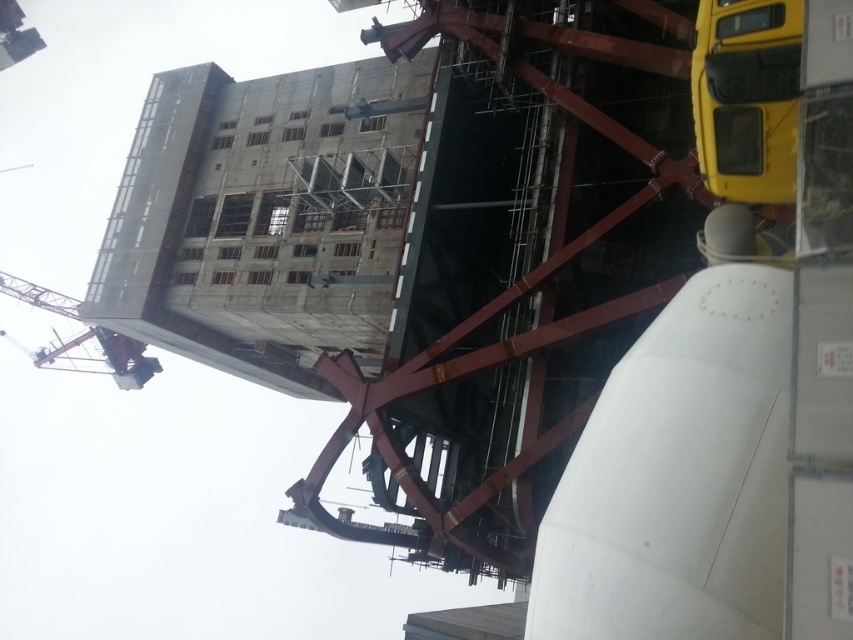
You are an inspector on the construction site and need to assess the placement of the yellow matte truck at upper right and the metallic red crane at upper left. From your vantage point, which object is higher in elevation?

The yellow matte truck at upper right is positioned over metallic red crane at upper left, meaning it is higher in elevation than the crane.

You are a construction worker who needs to transport materials to the upper floors of the building. You have access to the yellow matte truck at upper right and the metallic red crane at upper left. Which vehicle should you use for lifting materials to the higher levels?

The metallic red crane at upper left should be used for lifting materials to the higher levels because it is larger than the yellow matte truck at upper right, making it more suitable for heavy lifting tasks.